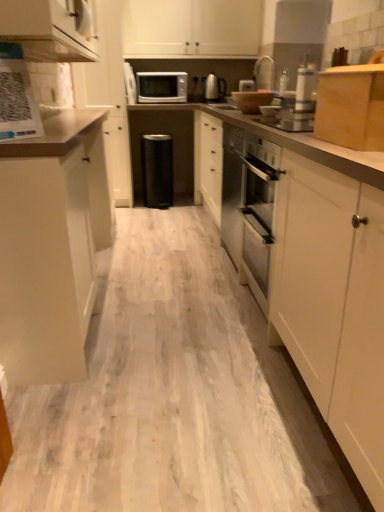
Question: Considering the positions of metallic silver toaster at upper center, the 3th appliance viewed from the left, and white glossy microwave oven at upper center in the image, is metallic silver toaster at upper center, the 3th appliance viewed from the left, taller or shorter than white glossy microwave oven at upper center?

Choices:
 (A) tall
 (B) short

Answer: (A)

Question: Is point (273, 59) closer or farther from the camera than point (142, 86)?

Choices:
 (A) closer
 (B) farther

Answer: (A)

Question: Estimate the real-world distances between objects in this image. Which object is closer to the white laminate countertop at center?

Choices:
 (A) white glossy qr code at upper left
 (B) white glossy cabinet at upper left, arranged as the 2th cabinetry when viewed from the left
 (C) white glossy microwave at upper center, arranged as the 1th appliance when viewed from the left
 (D) matte white cabinet at left, which appears as the 3th cabinetry when viewed from the left
 (E) metallic silver kettle at upper center, which is counted as the third appliance, starting from the front

Answer: (D)

Question: Based on their relative distances, which object is nearer to the white matte cabinet at upper center, positioned as the second cabinetry in right-to-left order?

Choices:
 (A) white matte cabinet at upper left, which appears as the fifth cabinetry when viewed from the right
 (B) metallic silver toaster at upper center, marked as the third appliance in a back-to-front arrangement
 (C) white glossy cabinet at upper left, the fourth cabinetry when ordered from right to left
 (D) white glossy microwave at upper center, arranged as the 1th appliance when viewed from the left
 (E) wooden box at upper right, the 5th cabinetry when ordered from left to right

Answer: (B)